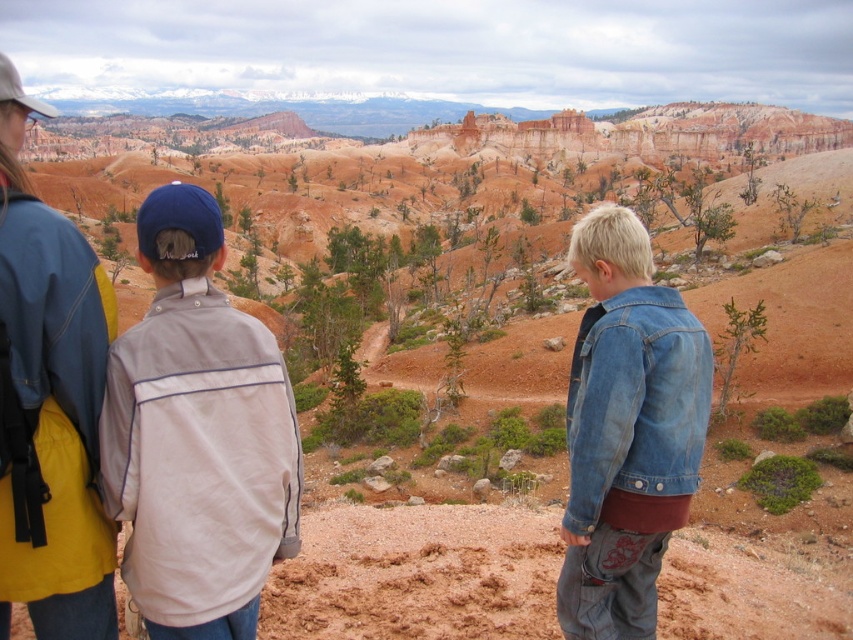
Question: Estimate the real-world distances between objects in this image. Which object is closer to the light gray fabric jacket at center left?

Choices:
 (A) brushed metal jacket at upper left
 (B) denim jacket at lower right

Answer: (A)

Question: Does light gray fabric jacket at center left appear on the right side of denim jacket at lower right?

Choices:
 (A) yes
 (B) no

Answer: (B)

Question: Which of the following is the farthest from the observer?

Choices:
 (A) denim jacket at lower right
 (B) brushed metal jacket at upper left
 (C) light gray fabric jacket at center left

Answer: (A)

Question: Is light gray fabric jacket at center left below denim jacket at lower right?

Choices:
 (A) no
 (B) yes

Answer: (A)

Question: Which object is the farthest from the brushed metal jacket at upper left?

Choices:
 (A) denim jacket at lower right
 (B) light gray fabric jacket at center left

Answer: (A)

Question: Does light gray fabric jacket at center left come in front of denim jacket at lower right?

Choices:
 (A) yes
 (B) no

Answer: (A)